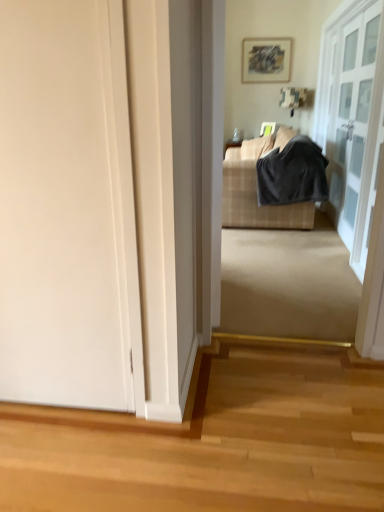
Question: Considering the relative sizes of matte gray picture frame at upper center and dark gray fabric at center in the image provided, is matte gray picture frame at upper center smaller than dark gray fabric at center?

Choices:
 (A) no
 (B) yes

Answer: (B)

Question: From the image's perspective, is matte gray picture frame at upper center located beneath dark gray fabric at center?

Choices:
 (A) yes
 (B) no

Answer: (B)

Question: From the image's perspective, is matte gray picture frame at upper center on dark gray fabric at center?

Choices:
 (A) yes
 (B) no

Answer: (A)

Question: Is matte gray picture frame at upper center looking in the opposite direction of dark gray fabric at center?

Choices:
 (A) no
 (B) yes

Answer: (A)

Question: Considering the relative sizes of matte gray picture frame at upper center and dark gray fabric at center in the image provided, is matte gray picture frame at upper center shorter than dark gray fabric at center?

Choices:
 (A) no
 (B) yes

Answer: (B)

Question: Is the depth of matte gray picture frame at upper center greater than that of dark gray fabric at center?

Choices:
 (A) no
 (B) yes

Answer: (B)

Question: Can you see dark gray fabric at center touching white matte door at left, the first door positioned from the front?

Choices:
 (A) no
 (B) yes

Answer: (A)

Question: From a real-world perspective, does dark gray fabric at center stand above white matte door at left, the first door positioned from the front?

Choices:
 (A) no
 (B) yes

Answer: (A)

Question: Considering the relative positions of dark gray fabric at center and white matte door at left, the 2th door in the right-to-left sequence, in the image provided, is dark gray fabric at center behind white matte door at left, the 2th door in the right-to-left sequence,?

Choices:
 (A) yes
 (B) no

Answer: (A)

Question: Can you confirm if dark gray fabric at center is shorter than white matte door at left, the 2th door in the right-to-left sequence?

Choices:
 (A) no
 (B) yes

Answer: (B)

Question: From the image's perspective, is dark gray fabric at center above white matte door at left, the 2th door in the right-to-left sequence?

Choices:
 (A) no
 (B) yes

Answer: (B)

Question: Is there a large distance between dark gray fabric at center and white matte door at left, the 2th door in the right-to-left sequence?

Choices:
 (A) yes
 (B) no

Answer: (A)

Question: Is plaid fabric couch at center thinner than matte gray picture frame at upper center?

Choices:
 (A) yes
 (B) no

Answer: (B)